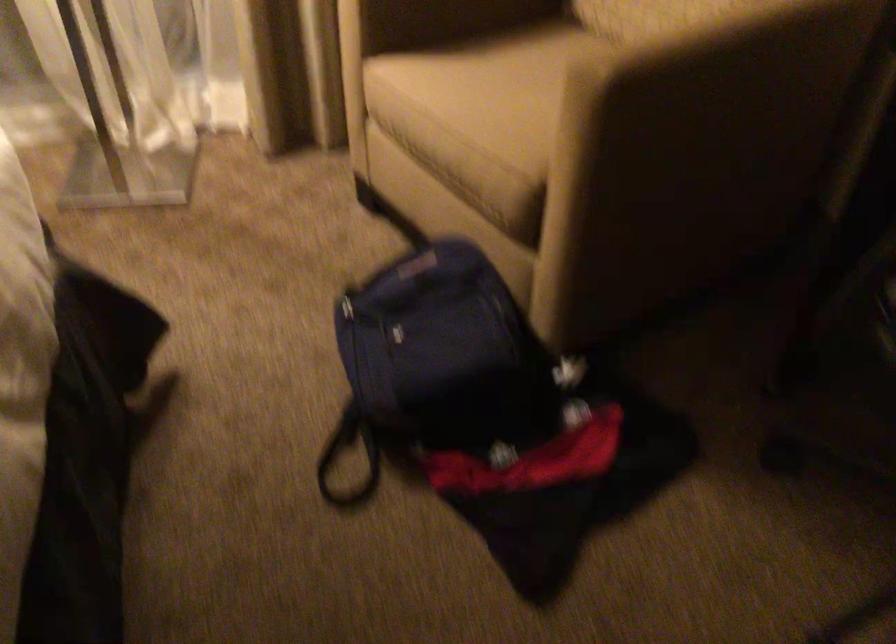
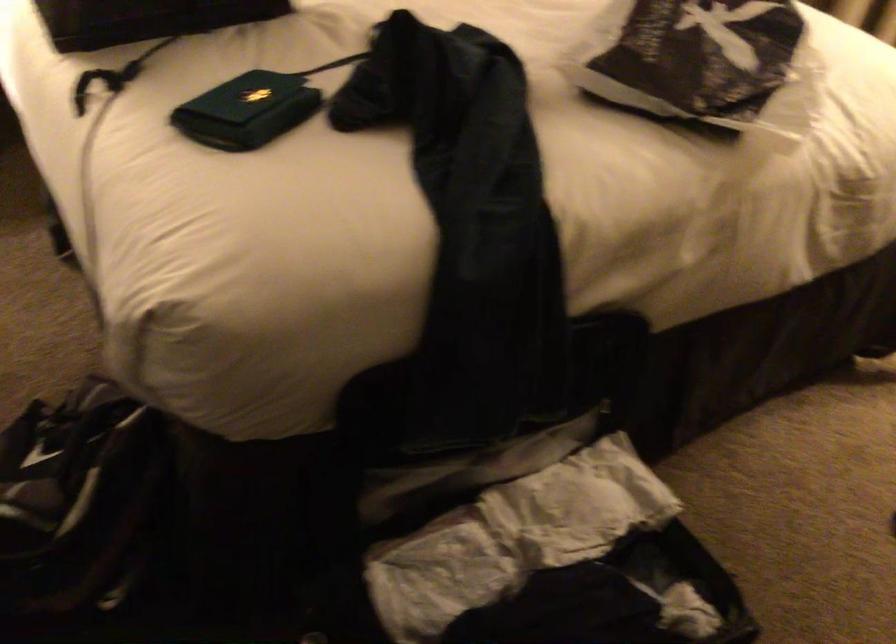
First-person continuous shooting, in which direction is the camera rotating?

The camera rotated toward left-down.